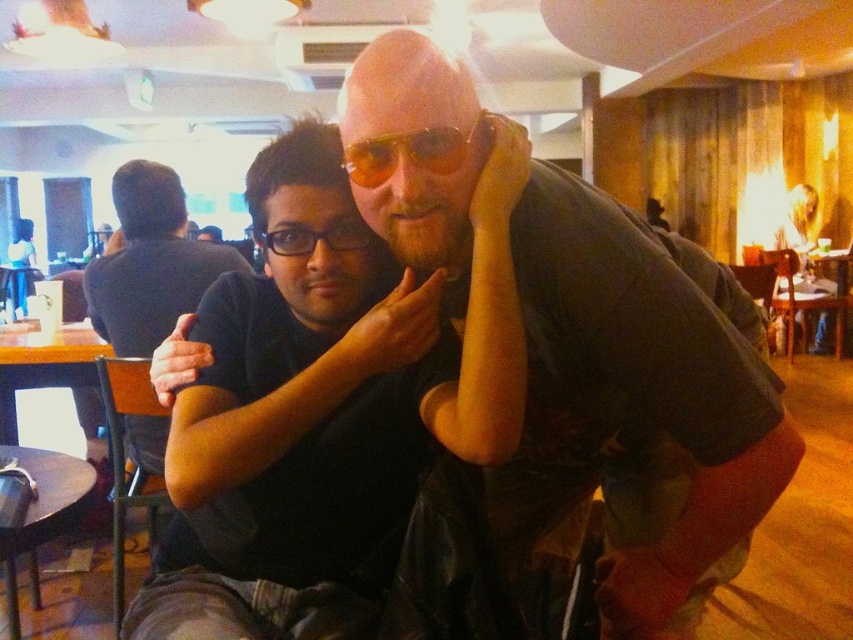
Based on the coordinates provided in the Objects Description, where is the matte black shirt at center positioned in the image?

The matte black shirt at center is located at point coordinates 0.648 along the x axis and 0.742 along the y axis.

In the scene shown: You are a photographer positioned at the entrance of the cafe. You want to take a photo of the dark wood table at lower left and the matte skin hand at center. Which object should you focus on first to ensure both are in sharp focus?

The dark wood table at lower left is further to the viewer than the matte skin hand at center, so you should focus on the dark wood table at lower left first to ensure both are in sharp focus.

You are taking a photo of the scene and want to focus on both the point at point (x=42, y=512) and the point at point (x=416, y=324). Which point is closer to the camera?

Point (x=416, y=324) is closer to the camera than point (x=42, y=512).